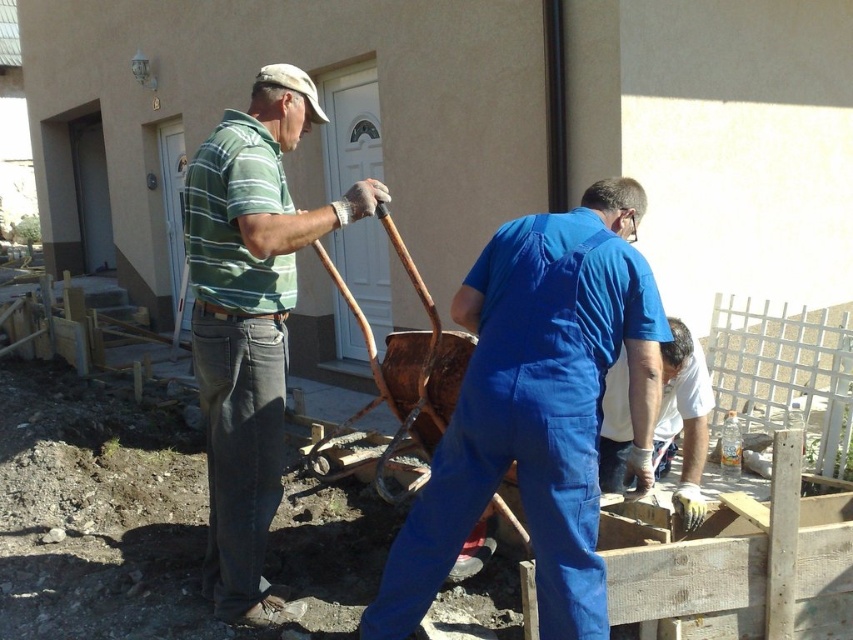
You are a construction worker who needs to locate the blue coveralls at center. According to the coordinates provided, where exactly would you find them?

The blue coveralls at center are located at coordinates point [537,408].